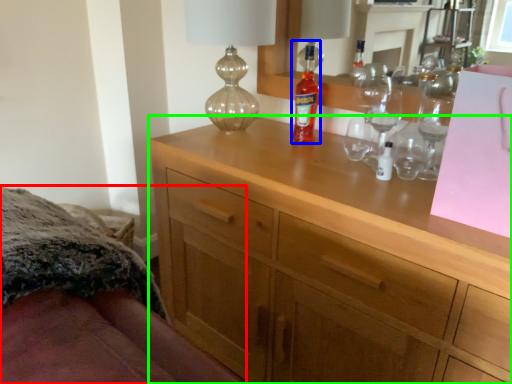
Question: Considering the real-world distances, which object is farthest from bed (highlighted by a red box)? bottle (highlighted by a blue box) or chest of drawers (highlighted by a green box)?

Choices:
 (A) bottle
 (B) chest of drawers

Answer: (A)